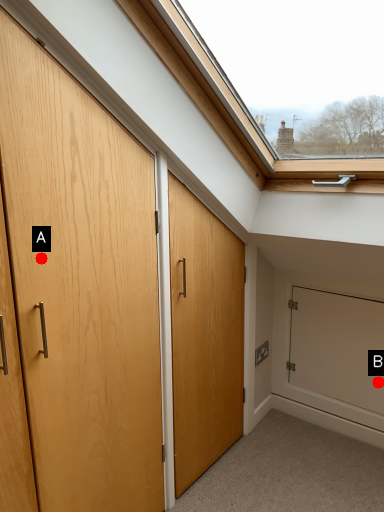
Question: Two points are circled on the image, labeled by A and B beside each circle. Which point is farther to the camera?

Choices:
 (A) A is further
 (B) B is further

Answer: (B)